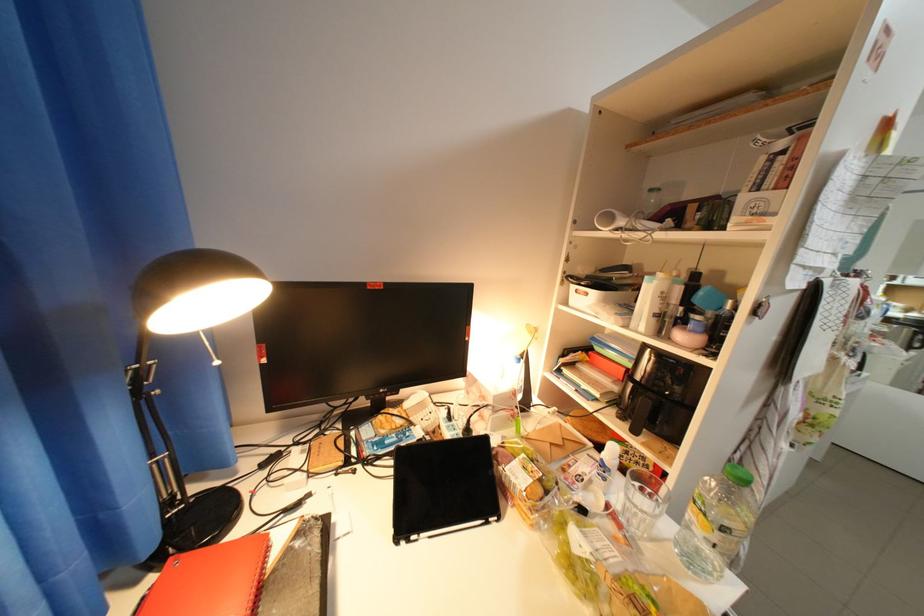
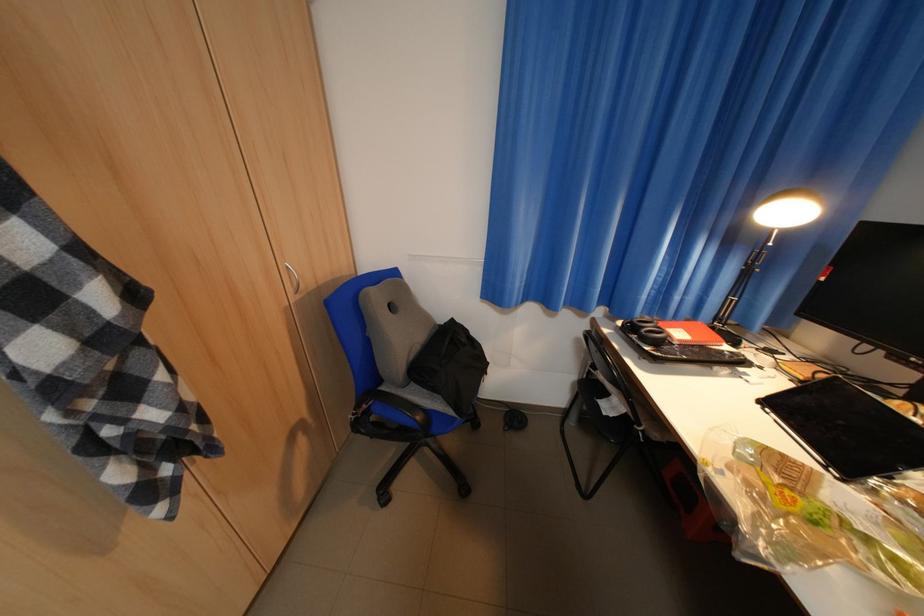
The images are taken continuously from a first-person perspective. In which direction is your viewpoint rotating?

The camera rotated toward left-down.